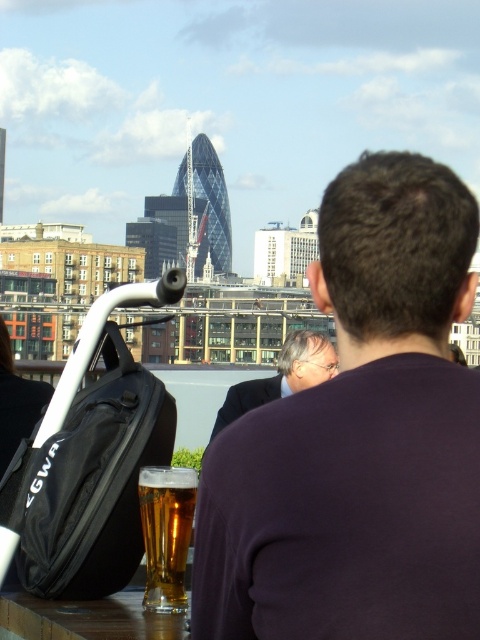
You are standing at the rooftop bar and want to greet the person wearing the dark purple shirt at center. Which direction should you walk relative to the dark suit at center to reach them?

The dark purple shirt at center is to the right of the dark suit at center, so you should walk to the right of the dark suit at center to reach them.

You are standing at the center of the rooftop and want to place a new decorative item exactly at the point marked as point (x=166, y=532). What object is currently occupying that location?

The translucent glass at lower center is located at point (x=166, y=532).

You are standing at the rooftop bar and want to wave to the person in the dark purple shirt at center and the dark suit at center. Which one can you reach first if you move forward?

The dark purple shirt at center is closer to the viewer than the dark suit at center, so you can reach the dark purple shirt at center first.